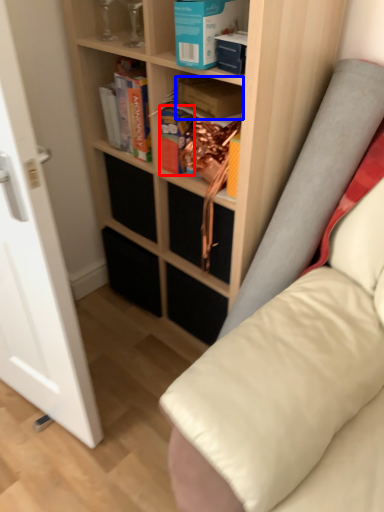
Question: Among these objects, which one is farthest to the camera, paperback book (highlighted by a red box) or paperback book (highlighted by a blue box)?

Choices:
 (A) paperback book
 (B) paperback book

Answer: (A)